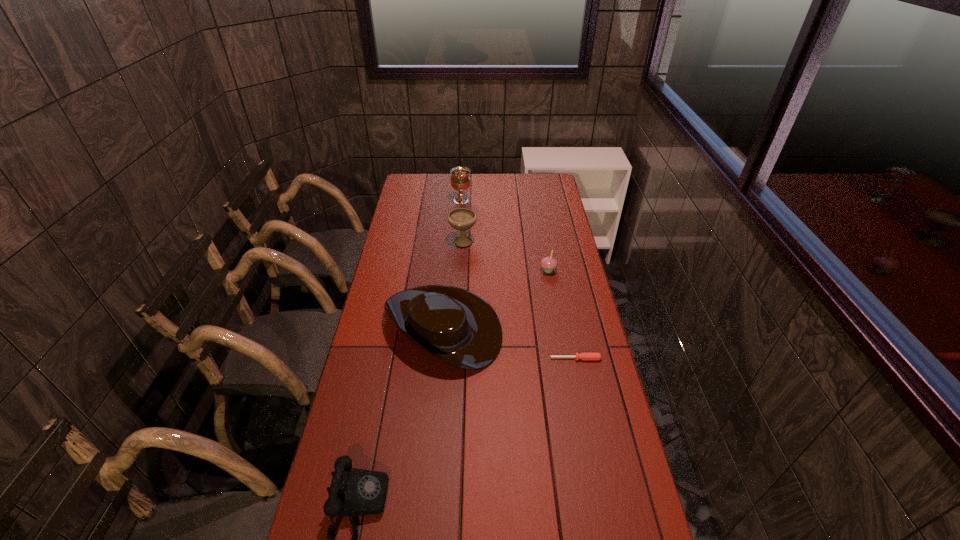
The height and width of the screenshot is (540, 960). What are the coordinates of `the tallest object` in the screenshot? It's located at (460, 180).

Locate an element on the screen. the farther chalice is located at coordinates (460, 180).

Where is `the second farthest object`? The height and width of the screenshot is (540, 960). the second farthest object is located at coordinates (461, 219).

Locate an element on the screen. Image resolution: width=960 pixels, height=540 pixels. the shorter chalice is located at coordinates (461, 219).

Find the location of a particular element. This screenshot has width=960, height=540. cowboy hat is located at coordinates (460, 328).

In order to click on the third farthest object in this screenshot , I will do `click(549, 263)`.

This screenshot has width=960, height=540. What are the coordinates of `the shortest object` in the screenshot? It's located at (583, 356).

Image resolution: width=960 pixels, height=540 pixels. Find the location of `vacant space located 0.150m on the back of the farthest object`. vacant space located 0.150m on the back of the farthest object is located at coordinates (463, 181).

Where is `vacant space located on the back of the fifth shortest object`? Image resolution: width=960 pixels, height=540 pixels. vacant space located on the back of the fifth shortest object is located at coordinates (x=465, y=206).

This screenshot has height=540, width=960. What are the coordinates of `vacant area situated 0.070m on the front of the cowboy hat` in the screenshot? It's located at tap(437, 395).